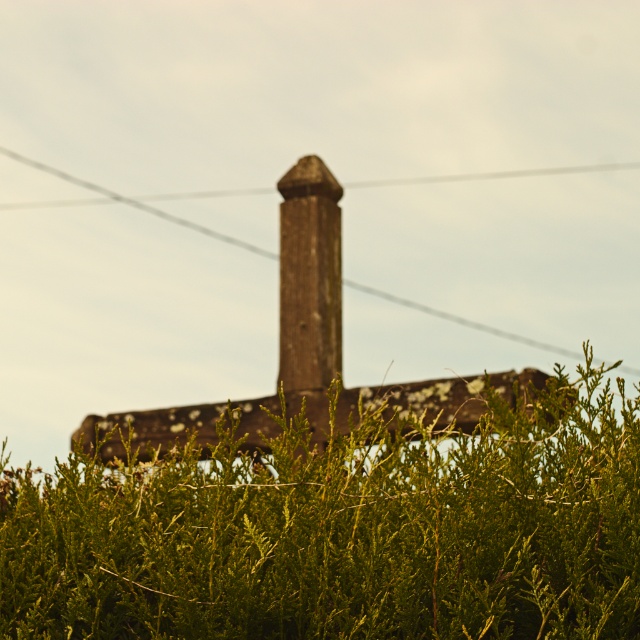
Does point (337, 612) lie in front of point (326, 284)?

That is True.

Describe the element at coordinates (342, 531) in the screenshot. Image resolution: width=640 pixels, height=640 pixels. I see `green leafy hedge at center` at that location.

Find the location of a particular element. Image resolution: width=640 pixels, height=640 pixels. green leafy hedge at center is located at coordinates (342, 531).